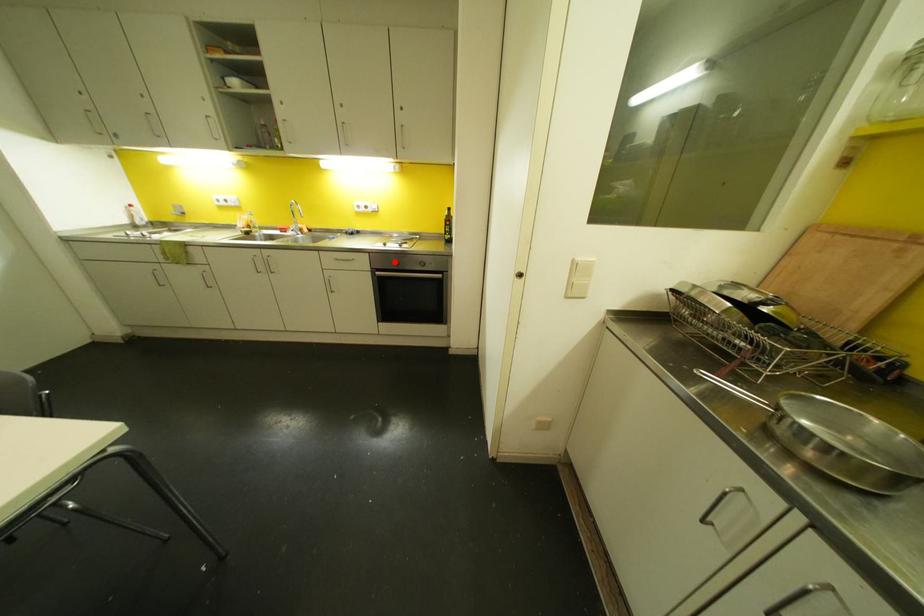
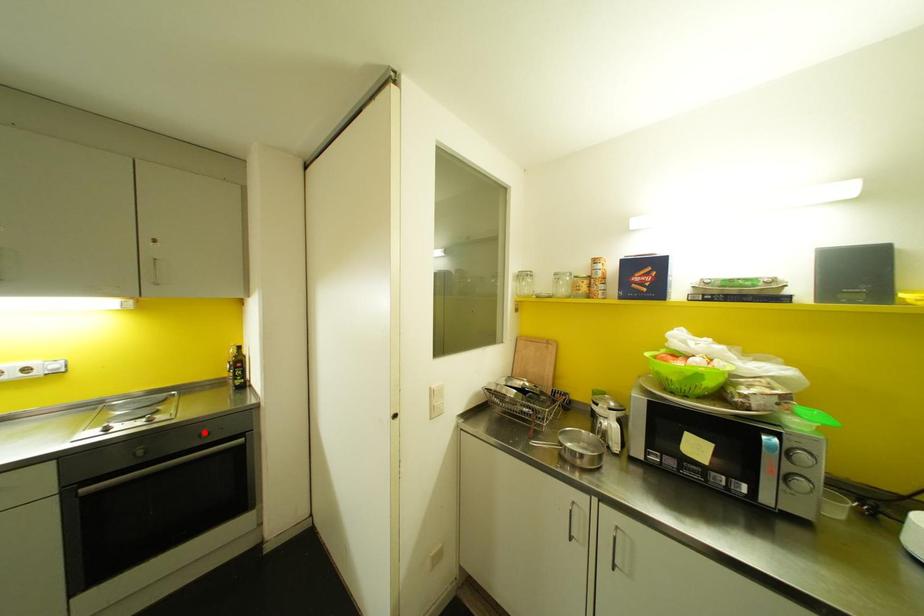
I am providing you with two images of the same scene from different viewpoints. A red point is marked on the first image and another point is marked on the second image. Is the marked point in image1 the same physical position as the marked point in image2?

No